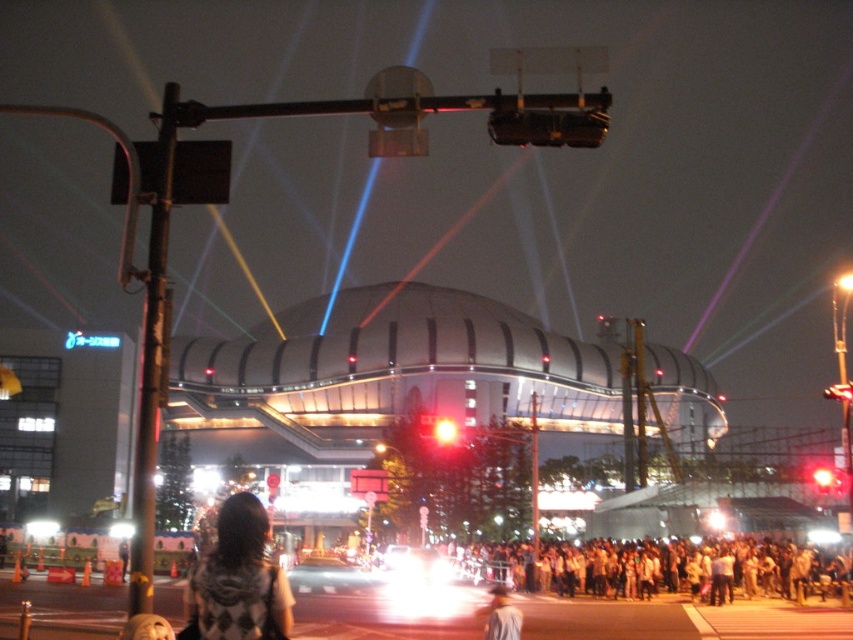
Measure the distance between point (270, 592) and camera.

Point (270, 592) is 48.48 meters away from camera.

Who is positioned more to the left, plaid scarf at lower center or red glass traffic light at center?

plaid scarf at lower center

Between point (247, 589) and point (444, 440), which one is positioned behind?

Positioned behind is point (444, 440).

The width and height of the screenshot is (853, 640). I want to click on plaid scarf at lower center, so click(238, 580).

Who is shorter, red glass traffic light at center or bright red light at center?

Standing shorter between the two is bright red light at center.

Which is in front, point (456, 426) or point (820, 474)?

Point (820, 474) is in front.

Identify the location of red glass traffic light at center. (444, 429).

Describe the element at coordinates (502, 616) in the screenshot. This screenshot has width=853, height=640. I see `light brown fabric jacket at center` at that location.

Who is more forward, (x=502, y=584) or (x=831, y=385)?

Positioned in front is point (x=502, y=584).

Who is more forward, (515,618) or (830,397)?

Point (515,618) is in front.

I want to click on light brown fabric jacket at center, so click(502, 616).